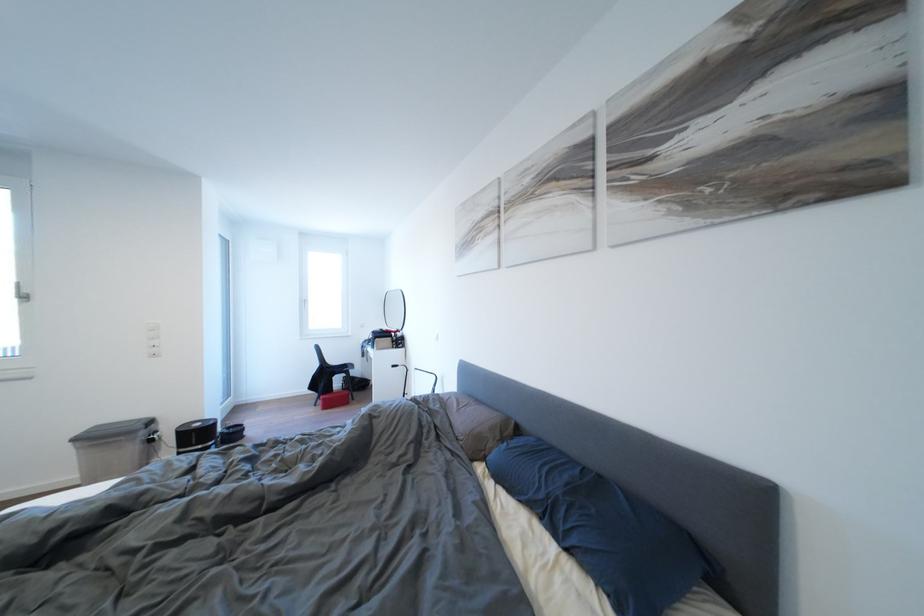
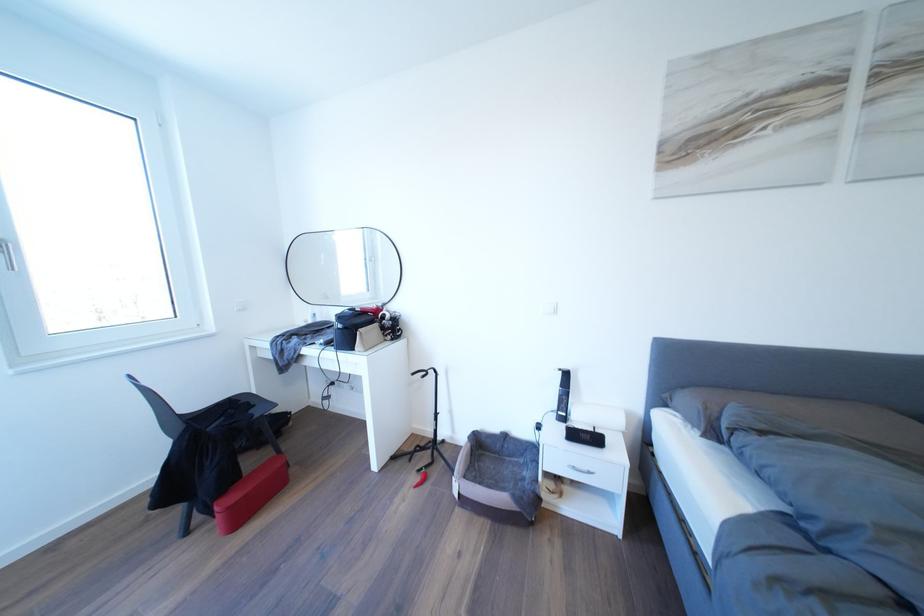
Locate, in the second image, the point that corresponds to the point at 311,307 in the first image.

(6, 254)